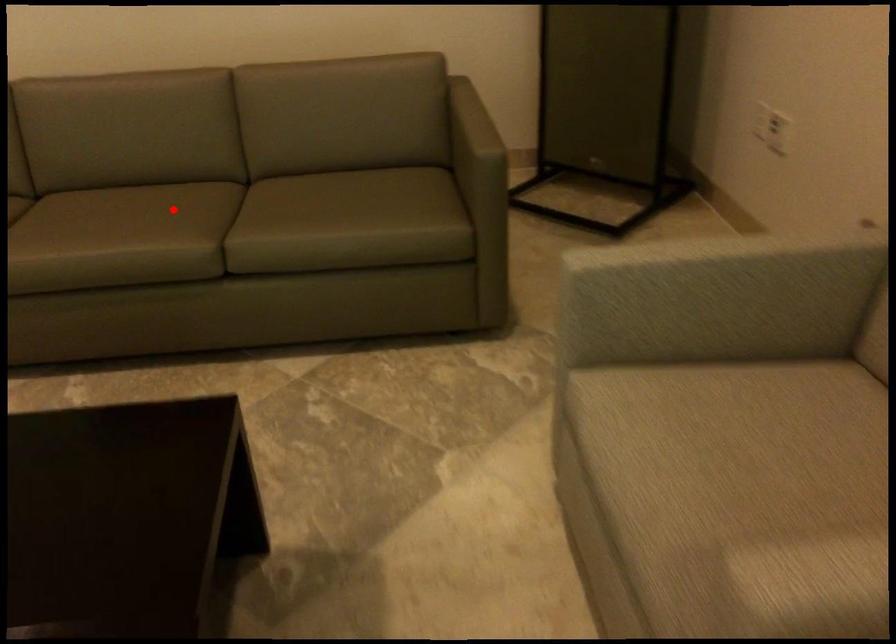
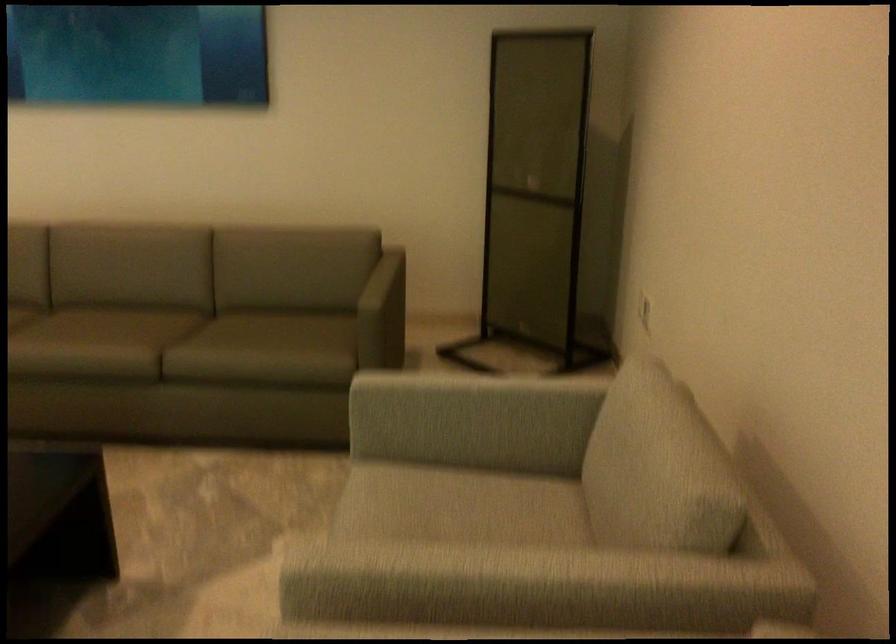
The point at the highlighted location is marked in the first image. Where is the corresponding point in the second image?

(128, 327)